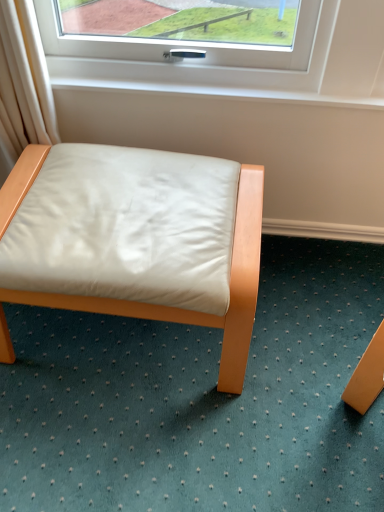
Where is `white leather ottoman at center`? white leather ottoman at center is located at coordinates (187, 310).

What do you see at coordinates (187, 310) in the screenshot? This screenshot has height=512, width=384. I see `white leather ottoman at center` at bounding box center [187, 310].

In order to click on white leather ottoman at center in this screenshot , I will do `click(187, 310)`.